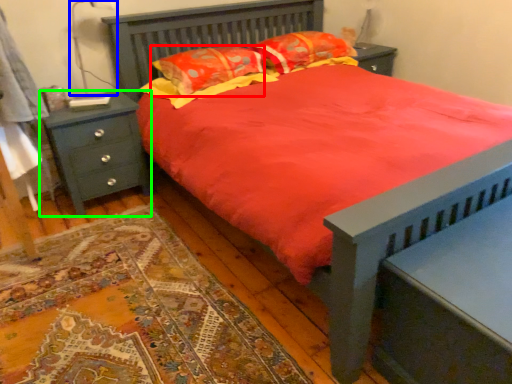
Question: Based on their relative distances, which object is nearer to pillow (highlighted by a red box)? Choose from table lamp (highlighted by a blue box) and nightstand (highlighted by a green box).

Choices:
 (A) table lamp
 (B) nightstand

Answer: (B)